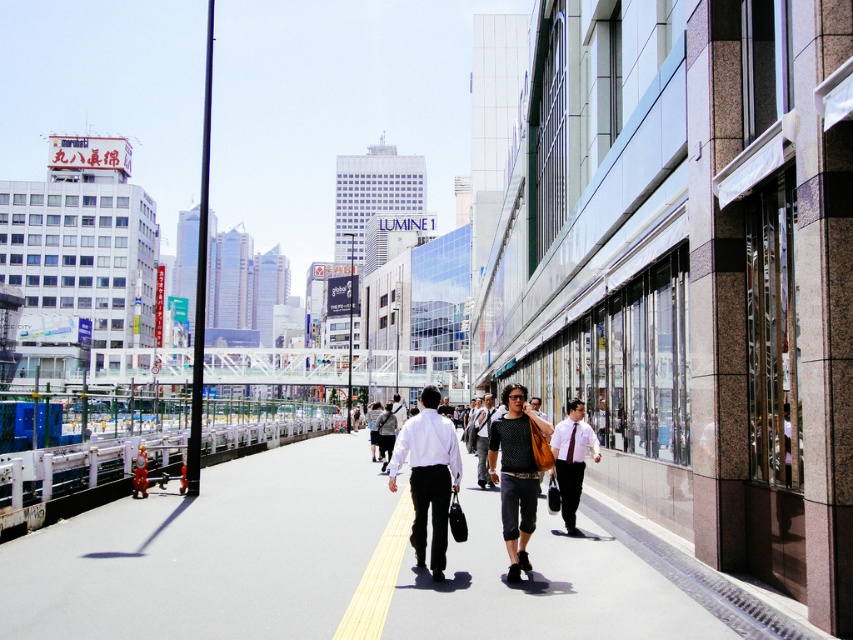
Who is lower down, white glossy shirt at center or matte black shirt at center?

matte black shirt at center

How far apart are white glossy shirt at center and matte black shirt at center?

white glossy shirt at center and matte black shirt at center are 8.83 meters apart.

Between point (432, 497) and point (479, 442), which one is positioned in front?

Point (432, 497) is more forward.

This screenshot has width=853, height=640. Find the location of `white glossy shirt at center`. white glossy shirt at center is located at coordinates (428, 476).

Which is in front, point (434, 476) or point (508, 500)?

Point (508, 500) is more forward.

Measure the distance between point (456, 448) and camera.

They are 7.51 meters apart.

The width and height of the screenshot is (853, 640). Find the location of `white glossy shirt at center`. white glossy shirt at center is located at coordinates (428, 476).

Who is higher up, dark gray textured shirt at center or white glossy shirt at center?

white glossy shirt at center is above.

Is point (431, 552) behind point (445, 518)?

No, it is in front of (445, 518).

Identify the location of dark gray textured shirt at center. The width and height of the screenshot is (853, 640). (426, 477).